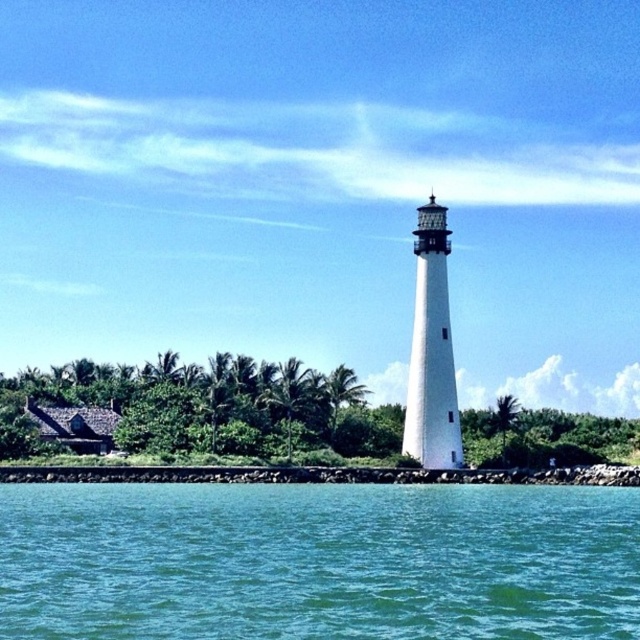
Question: Is clear blue water at lower center to the right of white textured lighthouse at center from the viewer's perspective?

Choices:
 (A) yes
 (B) no

Answer: (B)

Question: Is clear blue water at lower center in front of white textured lighthouse at center?

Choices:
 (A) yes
 (B) no

Answer: (A)

Question: Is clear blue water at lower center wider than white textured lighthouse at center?

Choices:
 (A) no
 (B) yes

Answer: (B)

Question: Which of the following is the farthest from the observer?

Choices:
 (A) white textured lighthouse at center
 (B) clear blue water at lower center

Answer: (A)